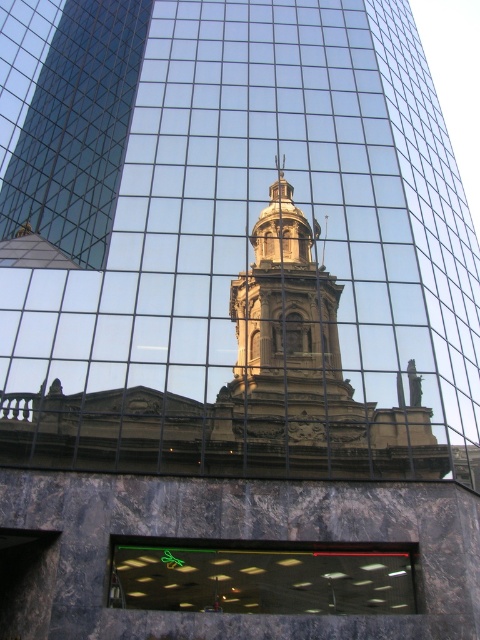
Question: Does translucent glass window at center have a greater width compared to golden stone bell tower at center?

Choices:
 (A) yes
 (B) no

Answer: (A)

Question: Observing the image, what is the correct spatial positioning of translucent glass window at center in reference to golden stone bell tower at center?

Choices:
 (A) below
 (B) above

Answer: (A)

Question: Does translucent glass window at center have a smaller size compared to golden stone bell tower at center?

Choices:
 (A) yes
 (B) no

Answer: (A)

Question: Among these objects, which one is farthest from the camera?

Choices:
 (A) golden stone bell tower at center
 (B) translucent glass window at center

Answer: (A)

Question: Among these points, which one is farthest from the camera?

Choices:
 (A) (241, 564)
 (B) (244, 326)

Answer: (B)